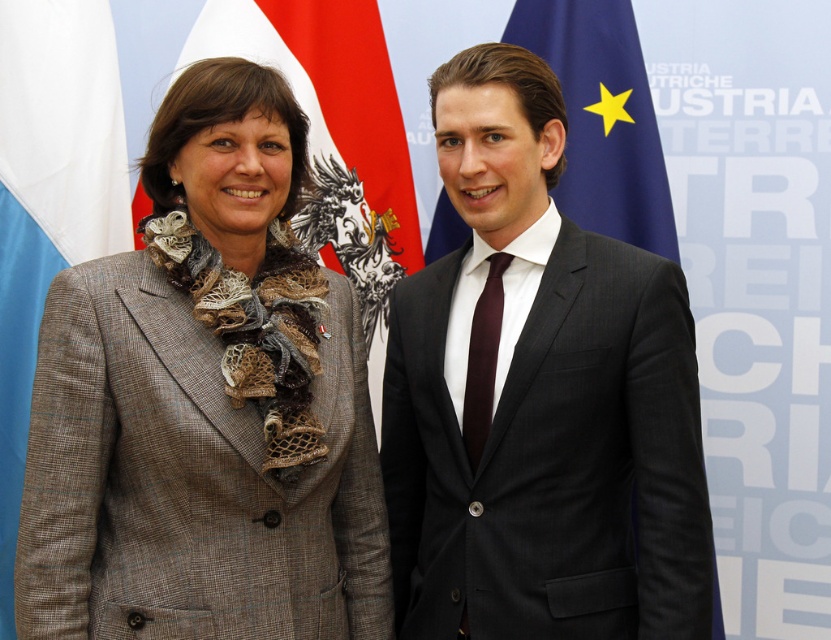
Does white fabric flag at left appear on the left side of blue fabric flag at upper center?

Indeed, white fabric flag at left is positioned on the left side of blue fabric flag at upper center.

Does white fabric flag at left appear on the right side of blue fabric flag at upper center?

No, white fabric flag at left is not to the right of blue fabric flag at upper center.

Who is more distant from viewer, (20, 406) or (622, 52)?

Positioned behind is point (622, 52).

This screenshot has height=640, width=831. Find the location of `white fabric flag at left`. white fabric flag at left is located at coordinates (48, 198).

Can you confirm if plaid wool coat at center is shorter than dark gray suit at center?

Yes, plaid wool coat at center is shorter than dark gray suit at center.

I want to click on plaid wool coat at center, so 205,403.

You are a GUI agent. You are given a task and a screenshot of the screen. Output one action in this format:
    pyautogui.click(x=<x>, y=<y>)
    Task: Click on the plaid wool coat at center
    Image resolution: width=831 pixels, height=640 pixels.
    Given the screenshot: What is the action you would take?
    pyautogui.click(x=205, y=403)

Does red fabric flag at upper left have a greater width compared to burgundy silk tie at center?

Yes.

What do you see at coordinates (335, 138) in the screenshot? I see `red fabric flag at upper left` at bounding box center [335, 138].

Identify the location of red fabric flag at upper left. This screenshot has width=831, height=640. (335, 138).